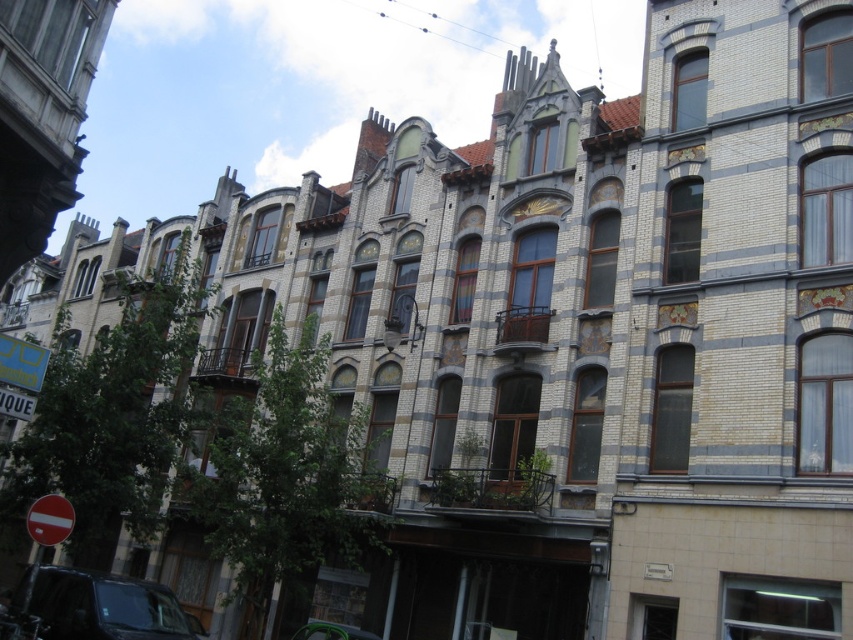
You are standing on the sidewalk in front of these buildings and want to read the text on the red plastic sign at lower left. Is the sign close enough for you to read the text without moving closer?

The red plastic sign at lower left is 114.53 feet away from the viewer. At this distance, it would be difficult to read the text on the sign without moving closer.

You are a delivery driver approaching the street with the red plastic sign at lower left and the metallic silver car at lower center. Which object is closer to the left side of the road?

The red plastic sign at lower left is positioned on the left side of the metallic silver car at lower center, so it is closer to the left side of the road.